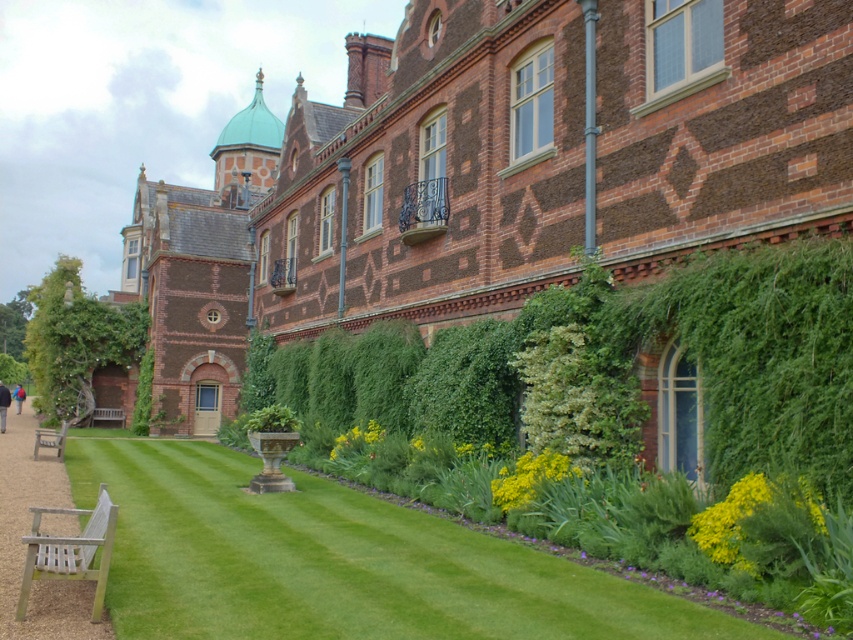
You are standing in front of the grand historic building and want to sit down to rest. Where is the wooden park bench at lower left located in the image?

The wooden park bench at lower left is located at the 2D coordinates point [50,440] in the image.

You are a visitor standing in front of the historic building and want to sit down to rest. The wooden bench at lower left and the yellow matte flower at lower center are both in your view. Which object would provide a more comfortable seating option?

The wooden bench at lower left is larger in size compared to the yellow matte flower at lower center, so it would be more comfortable for sitting.

You are a visitor standing in front of the grand historic building. You see a wooden bench at lower left and a yellow matte flower at lower center. Which object is positioned more to the left side of the scene?

The wooden bench at lower left is positioned more to the left side of the scene than the yellow matte flower at lower center.